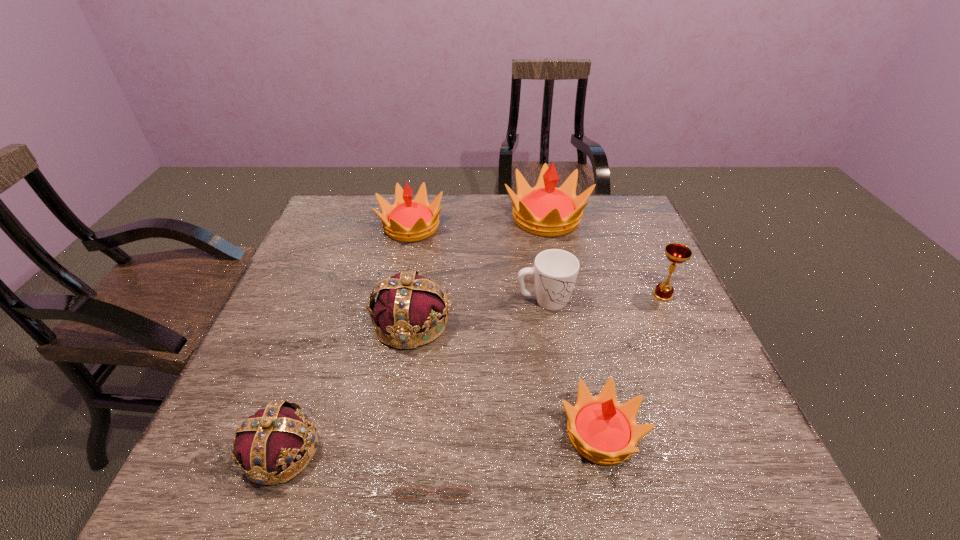
In order to click on sunglasses in this screenshot , I will do `click(408, 492)`.

Where is `free space located 0.050m on the left of the tallest crown`? free space located 0.050m on the left of the tallest crown is located at coordinates (488, 219).

This screenshot has height=540, width=960. I want to click on vacant space located on the back of the second smallest yellow crown, so (419, 195).

The image size is (960, 540). Identify the location of vacant space situated on the right of the bigger purple crown. (585, 322).

This screenshot has width=960, height=540. Find the location of `vacant space situated 0.190m on the left of the chalice`. vacant space situated 0.190m on the left of the chalice is located at coordinates (578, 295).

This screenshot has width=960, height=540. In order to click on free region located on the side of the mug with the handle in this screenshot , I will do `click(615, 301)`.

At what (x,y) coordinates should I click in order to perform the action: click on vacant region located on the right of the nearest yellow crown. Please return your answer as a coordinate pair (x, y). This screenshot has height=540, width=960. Looking at the image, I should click on (730, 434).

You are a GUI agent. You are given a task and a screenshot of the screen. Output one action in this format:
    pyautogui.click(x=<x>, y=<y>)
    Task: Click on the blank space located 0.210m on the right of the smaller purple crown
    The width and height of the screenshot is (960, 540).
    Given the screenshot: What is the action you would take?
    pyautogui.click(x=432, y=451)

The height and width of the screenshot is (540, 960). I want to click on sunglasses situated at the near edge, so click(x=408, y=492).

Find the location of `object that is positioned at the left edge`. object that is positioned at the left edge is located at coordinates (273, 438).